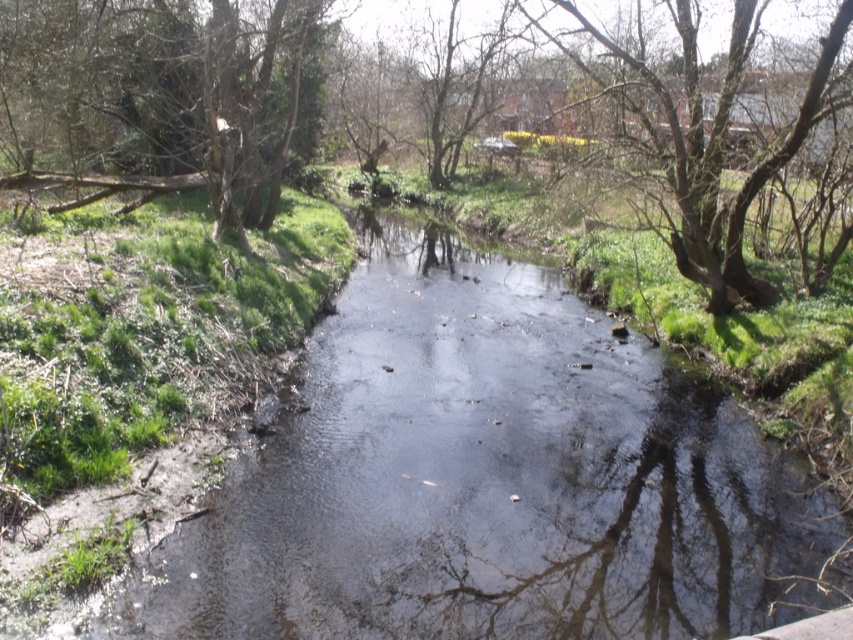
In the scene shown: Which is above, transparent water at center or green leafy tree at left?

Positioned higher is green leafy tree at left.

Which of these two, transparent water at center or green leafy tree at left, stands taller?

With more height is green leafy tree at left.

Does point (426, 529) come farther from viewer compared to point (96, 145)?

No, it is in front of (96, 145).

Identify the location of transparent water at center. (483, 477).

Does transparent water at center have a greater height compared to bare branches at upper right?

No, transparent water at center is not taller than bare branches at upper right.

Is transparent water at center bigger than bare branches at upper right?

No, transparent water at center is not bigger than bare branches at upper right.

Locate an element on the screen. This screenshot has height=640, width=853. transparent water at center is located at coordinates (483, 477).

Does point (161, 4) come in front of point (733, 92)?

No, (161, 4) is further to viewer.

Between point (0, 138) and point (769, 170), which one is positioned in front?

Point (769, 170) is in front.

Is point (190, 96) in front of point (712, 173)?

No.

Where is `green leafy tree at left`? green leafy tree at left is located at coordinates (155, 97).